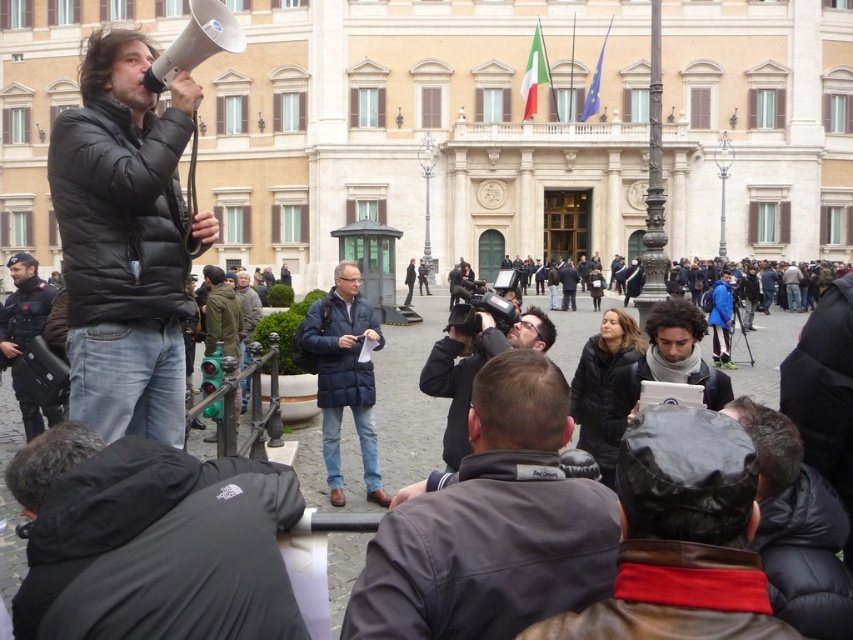
You are standing at the entrance of the large ornate building and need to locate the matte black jacket at left. According to the coordinates provided, where should you look relative to the entrance?

The matte black jacket at left is located at coordinates point (123, 241), which means it is positioned to the left side of the entrance and slightly below the center of the image.